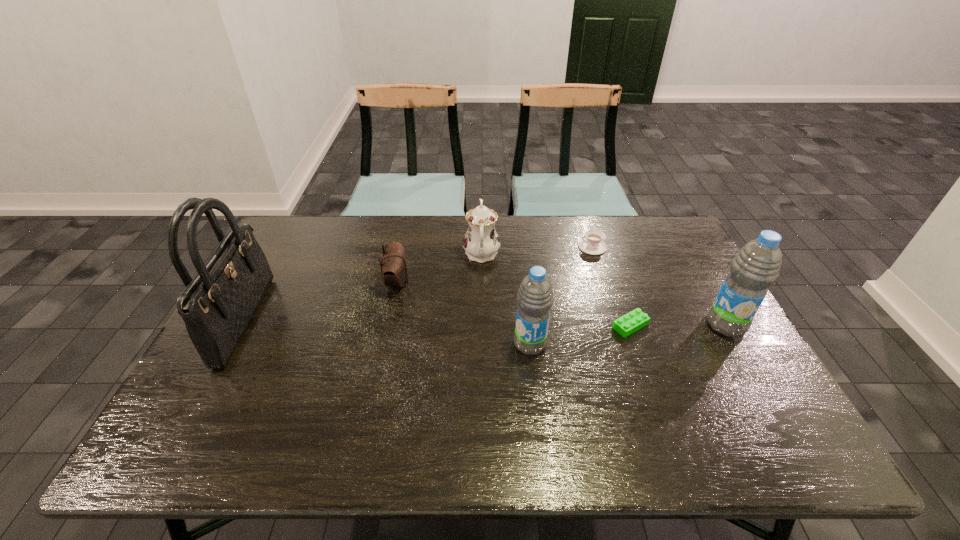
Identify the location of free point that keeps the water bottles evenly spaced on the left. (317, 364).